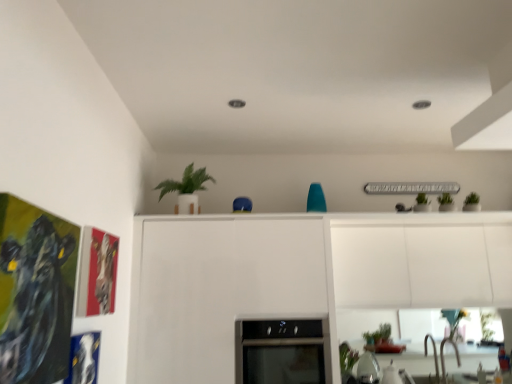
What is the approximate width of green matte plant at lower center?

It is 23.58 centimeters.

Where is `green matte plant at upper center`? The width and height of the screenshot is (512, 384). green matte plant at upper center is located at coordinates [x=186, y=189].

Where is `black glass oven at center`? black glass oven at center is located at coordinates (281, 351).

This screenshot has width=512, height=384. Find the location of `green matte plant at lower center`. green matte plant at lower center is located at coordinates (347, 359).

Find the location of a particular element. oven on the right of green matte plant at upper center is located at coordinates (281, 351).

Is black glass oven at center directly adjacent to green matte plant at upper center?

black glass oven at center and green matte plant at upper center are clearly separated.

Is black glass oven at center looking in the opposite direction of green matte plant at upper center?

No.

Considering the relative sizes of black glass oven at center and green matte plant at upper center in the image provided, is black glass oven at center smaller than green matte plant at upper center?

No.

In the scene shown: Which point is more forward, (343, 355) or (179, 183)?

Point (343, 355)

Is the surface of green matte plant at lower center in direct contact with green matte plant at upper center?

No, green matte plant at lower center is not in contact with green matte plant at upper center.

Is green matte plant at lower center not within green matte plant at upper center?

Yes.

From the image's perspective, is green matte plant at lower center on green matte plant at upper center?

Actually, green matte plant at lower center appears below green matte plant at upper center in the image.

What's the angular difference between green matte plant at lower center and metallic silver faucet at lower right's facing directions?

0.503 degrees.

Considering the points (345, 350) and (442, 373), which point is in front, point (345, 350) or point (442, 373)?

The point (345, 350) is closer to the camera.

From a real-world perspective, relative to metallic silver faucet at lower right, is green matte plant at lower center vertically above or below?

From a real-world perspective, green matte plant at lower center is physically above metallic silver faucet at lower right.

Considering the relative sizes of green matte plant at lower center and metallic silver faucet at lower right in the image provided, is green matte plant at lower center thinner than metallic silver faucet at lower right?

Indeed, green matte plant at lower center has a lesser width compared to metallic silver faucet at lower right.

From the picture: Is black glass oven at center placed right next to green matte plant at lower center?

black glass oven at center and green matte plant at lower center are clearly separated.

Which is behind, black glass oven at center or green matte plant at lower center?

Positioned behind is green matte plant at lower center.

Considering the points (236, 353) and (349, 354), which point is behind, point (236, 353) or point (349, 354)?

The point (349, 354) is behind.

Who is bigger, black glass oven at center or green matte plant at lower center?

black glass oven at center.

From the picture: Can you tell me how much green matte plant at upper center and metallic silver faucet at lower right differ in facing direction?

The angle between the facing direction of green matte plant at upper center and the facing direction of metallic silver faucet at lower right is 2.85 degrees.

Which object is wider, green matte plant at upper center or metallic silver faucet at lower right?

Wider between the two is green matte plant at upper center.

Can you confirm if green matte plant at upper center is taller than metallic silver faucet at lower right?

Correct, green matte plant at upper center is much taller as metallic silver faucet at lower right.

From the image's perspective, which object appears higher, green matte plant at upper center or green matte plant at lower center?

green matte plant at upper center appears higher in the image.

How much distance is there between green matte plant at upper center and green matte plant at lower center?

A distance of 1.55 meters exists between green matte plant at upper center and green matte plant at lower center.

From a real-world perspective, is green matte plant at upper center above or below green matte plant at lower center?

In terms of real-world spatial position, green matte plant at upper center is above green matte plant at lower center.

Would you say green matte plant at upper center is outside green matte plant at lower center?

Indeed, green matte plant at upper center is completely outside green matte plant at lower center.

From a real-world perspective, is green matte plant at upper center above or below black glass oven at center?

From a real-world perspective, green matte plant at upper center is physically above black glass oven at center.

Is green matte plant at upper center looking in the opposite direction of black glass oven at center?

No, green matte plant at upper center's orientation is not away from black glass oven at center.

How different are the orientations of green matte plant at upper center and black glass oven at center in degrees?

green matte plant at upper center and black glass oven at center are facing 3.03 degrees away from each other.

Is green matte plant at upper center taller than black glass oven at center?

In fact, green matte plant at upper center may be shorter than black glass oven at center.

The height and width of the screenshot is (384, 512). Identify the location of houseplant above the black glass oven at center (from the image's perspective). (186, 189).

Find the location of a particular element. Image resolution: width=512 pixels, height=384 pixels. plant on the right side of green matte plant at upper center is located at coordinates (347, 359).

When comparing their distances from black glass oven at center, does metallic silver faucet at lower right or green matte plant at lower center seem further?

metallic silver faucet at lower right is further to black glass oven at center.

Looking at the image, which one is located closer to metallic silver faucet at lower right, black glass oven at center or green matte plant at upper center?

black glass oven at center lies closer to metallic silver faucet at lower right than the other object.

Considering their positions, is green matte plant at lower center positioned further to metallic silver faucet at lower right than green matte plant at upper center?

green matte plant at upper center is positioned further to the anchor metallic silver faucet at lower right.

Based on their spatial positions, is metallic silver faucet at lower right or green matte plant at upper center closer to black glass oven at center?

The object closer to black glass oven at center is green matte plant at upper center.

From the image, which object appears to be farther from green matte plant at lower center, green matte plant at upper center or metallic silver faucet at lower right?

The object further to green matte plant at lower center is green matte plant at upper center.

Considering their positions, is green matte plant at lower center positioned further to green matte plant at upper center than black glass oven at center?

Based on the image, green matte plant at lower center appears to be further to green matte plant at upper center.

Looking at the image, which one is located closer to green matte plant at upper center, black glass oven at center or metallic silver faucet at lower right?

black glass oven at center is positioned closer to the anchor green matte plant at upper center.

When comparing their distances from green matte plant at upper center, does black glass oven at center or green matte plant at lower center seem further?

Among the two, green matte plant at lower center is located further to green matte plant at upper center.

Locate an element on the screen. The width and height of the screenshot is (512, 384). oven between green matte plant at upper center and metallic silver faucet at lower right in the horizontal direction is located at coordinates (281, 351).

The width and height of the screenshot is (512, 384). Find the location of `oven between green matte plant at upper center and green matte plant at lower center vertically`. oven between green matte plant at upper center and green matte plant at lower center vertically is located at coordinates (281, 351).

Locate an element on the screen. This screenshot has width=512, height=384. plant situated between black glass oven at center and metallic silver faucet at lower right from left to right is located at coordinates (347, 359).

The height and width of the screenshot is (384, 512). In order to click on plant between green matte plant at upper center and metallic silver faucet at lower right in this screenshot , I will do `click(347, 359)`.